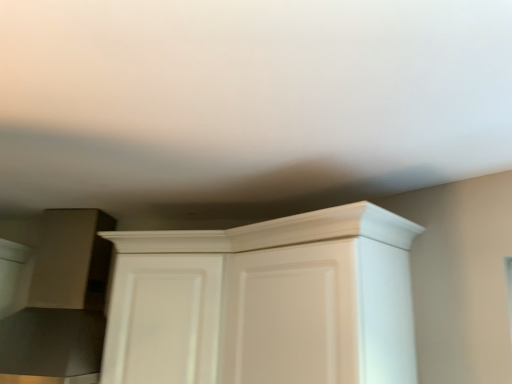
Question: Does point (189, 299) appear closer or farther from the camera than point (118, 377)?

Choices:
 (A) closer
 (B) farther

Answer: (A)

Question: From the image's perspective, is white glossy cabinet at center positioned above or below white matte cupboard at center?

Choices:
 (A) above
 (B) below

Answer: (B)

Question: Choose the correct answer: Is white glossy cabinet at center inside white matte cupboard at center or outside it?

Choices:
 (A) outside
 (B) inside

Answer: (B)

Question: Considering the positions of white matte cupboard at center and white glossy cabinet at center in the image, is white matte cupboard at center wider or thinner than white glossy cabinet at center?

Choices:
 (A) wide
 (B) thin

Answer: (A)

Question: Does point (162, 364) appear closer or farther from the camera than point (217, 279)?

Choices:
 (A) closer
 (B) farther

Answer: (A)

Question: From a real-world perspective, is white matte cupboard at center physically located above or below white glossy cabinet at center?

Choices:
 (A) above
 (B) below

Answer: (B)

Question: From their relative heights in the image, would you say white matte cupboard at center is taller or shorter than white glossy cabinet at center?

Choices:
 (A) tall
 (B) short

Answer: (A)